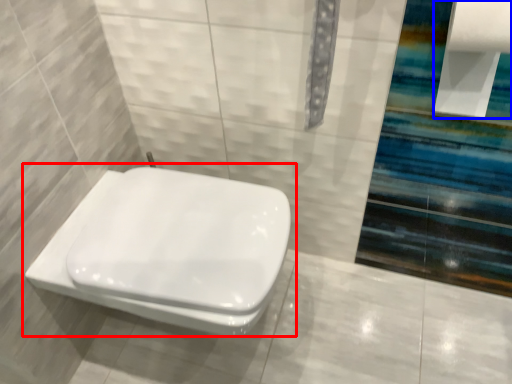
Question: Which point is further to the camera, toilet (highlighted by a red box) or toilet paper (highlighted by a blue box)?

Choices:
 (A) toilet
 (B) toilet paper

Answer: (A)